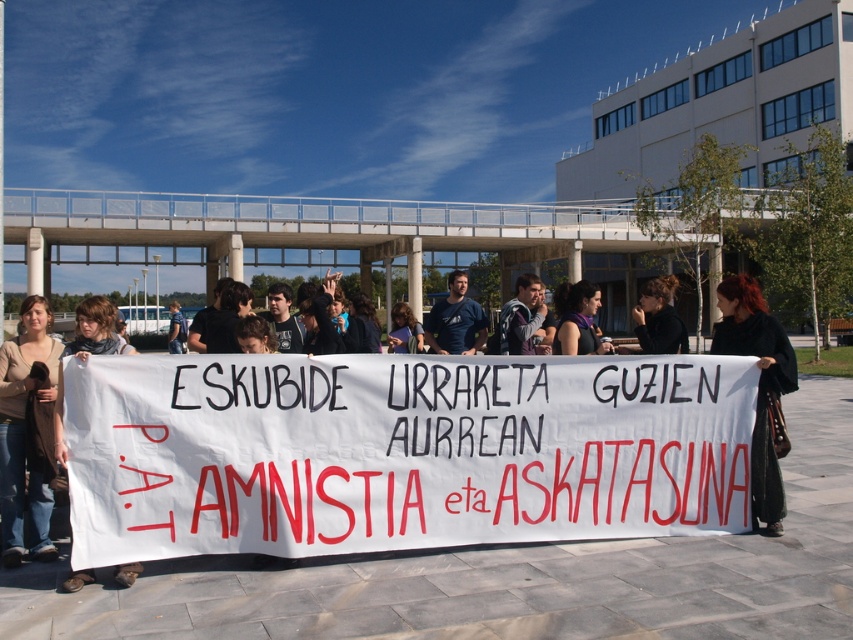
Question: Is dark brown leather jacket at lower right bigger than dark blue t-shirt at center?

Choices:
 (A) no
 (B) yes

Answer: (A)

Question: Which point appears closest to the camera in this image?

Choices:
 (A) (13, 493)
 (B) (589, 307)

Answer: (A)

Question: Which object appears farthest from the camera in this image?

Choices:
 (A) dark brown leather jacket at lower right
 (B) dark blue t-shirt at center
 (C) brown sweater at lower left
 (D) gray sweater at center

Answer: (B)

Question: Can you confirm if black fabric at center is smaller than purple scarf at center?

Choices:
 (A) no
 (B) yes

Answer: (A)

Question: Which of these objects is positioned closest to the purple scarf at center?

Choices:
 (A) matte black scarf at lower left
 (B) gray sweater at center

Answer: (B)

Question: Is dark brown leather jacket at lower right to the right of dark blue t-shirt at center from the viewer's perspective?

Choices:
 (A) no
 (B) yes

Answer: (B)